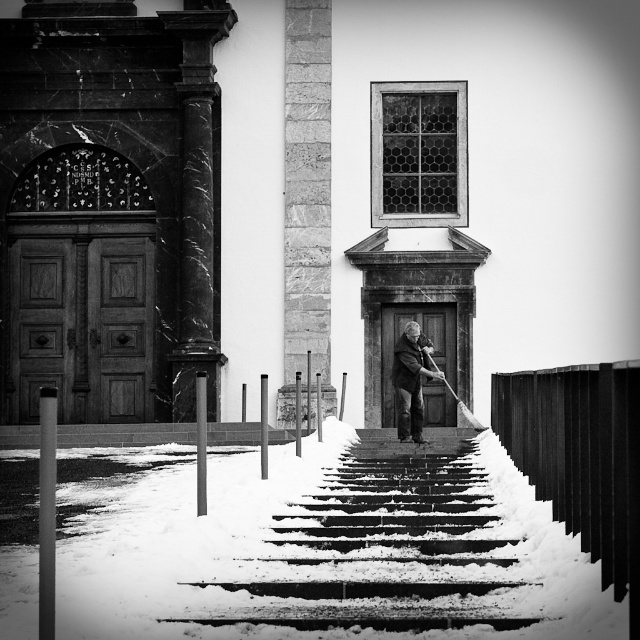
You are standing in front of the building and notice two points marked on the stone steps leading to the doors. The first point is at coordinates point (449, 497) and the second is at point (408, 374). Which point is closer to you as you face the building?

Point (449, 497) is closer to the viewer than point (408, 374).